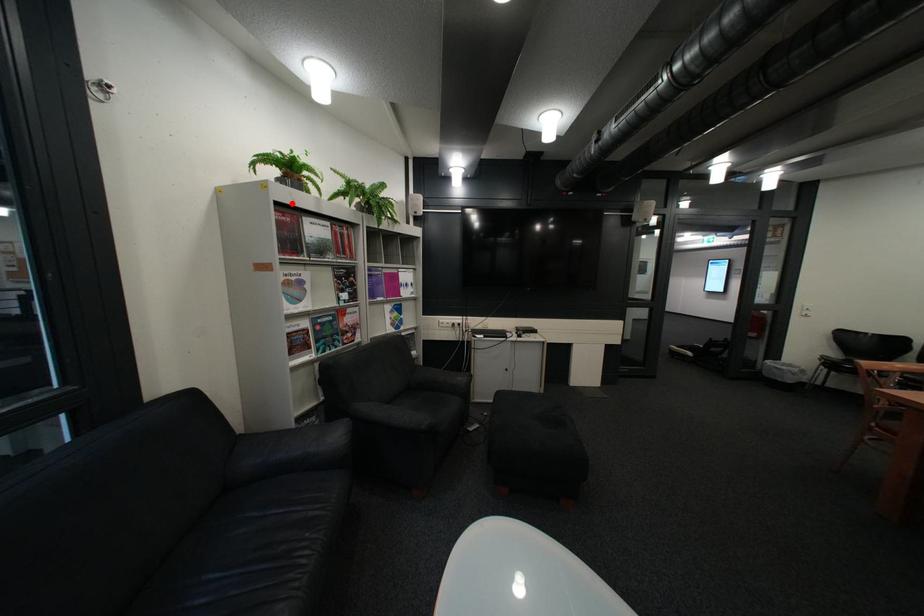
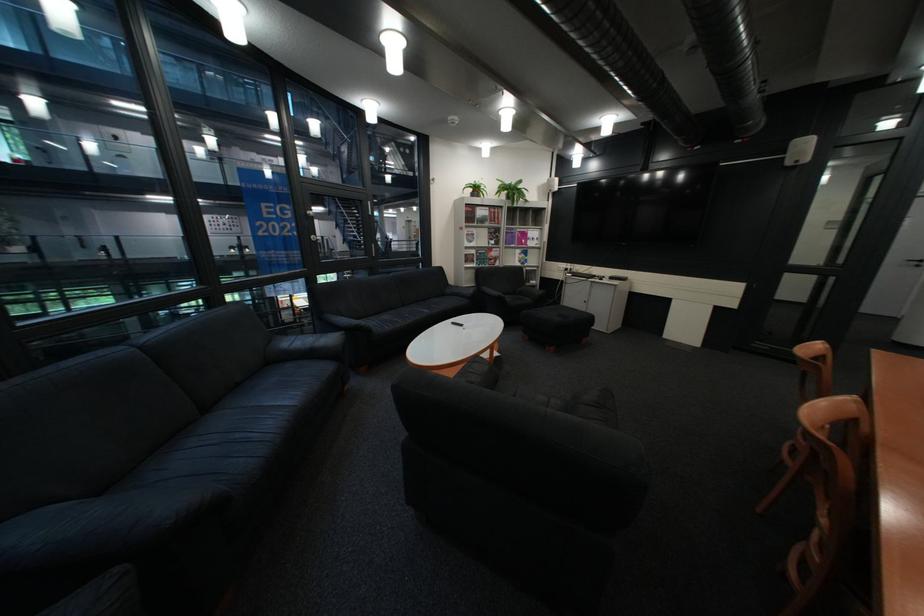
The point at the highlighted location is marked in the first image. Where is the corresponding point in the second image?

(481, 205)